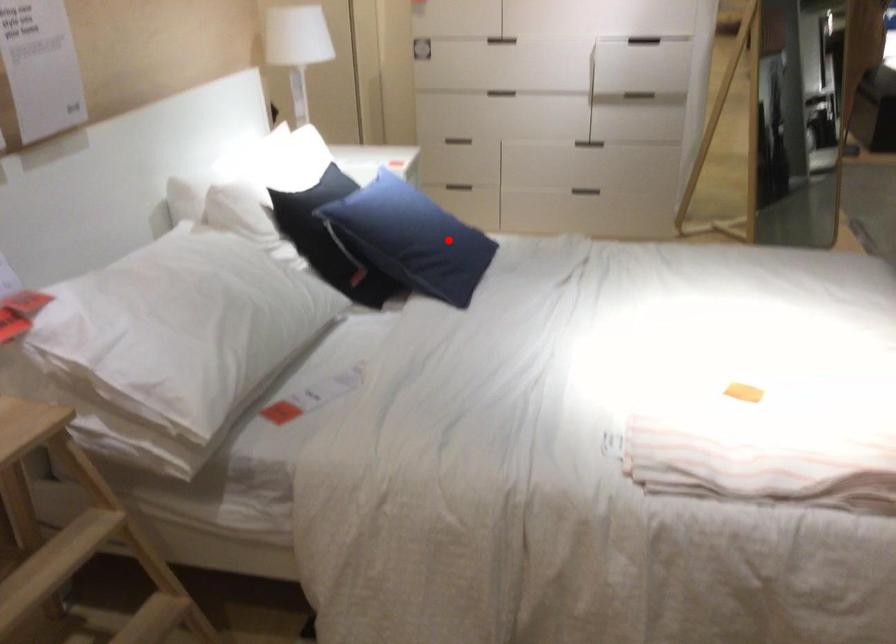
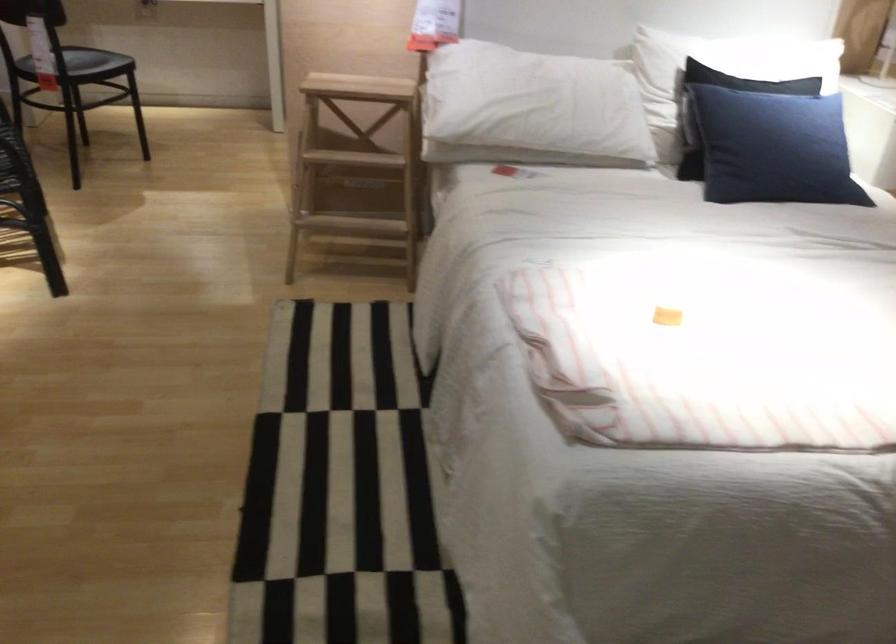
In the second image, find the point that corresponds to the highlighted location in the first image.

(773, 147)